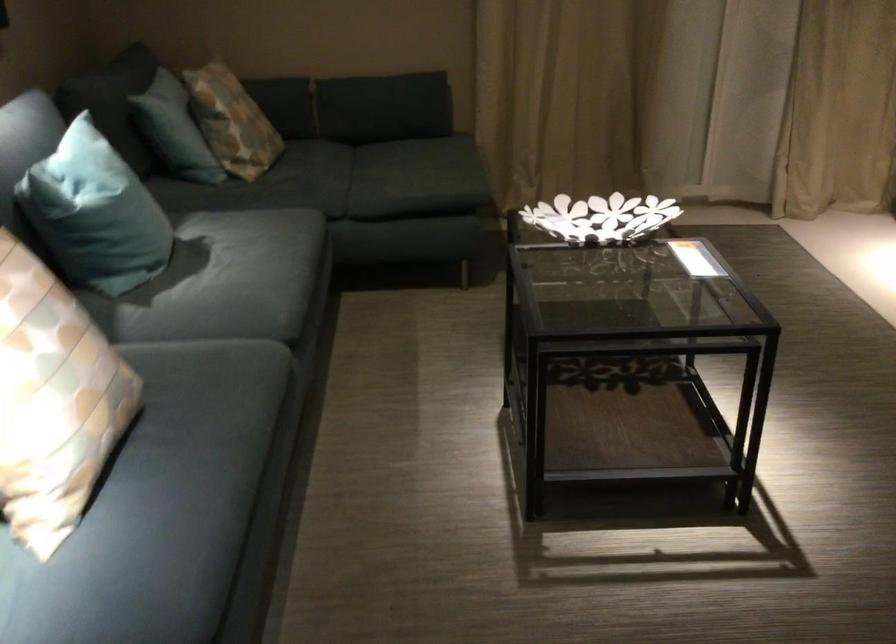
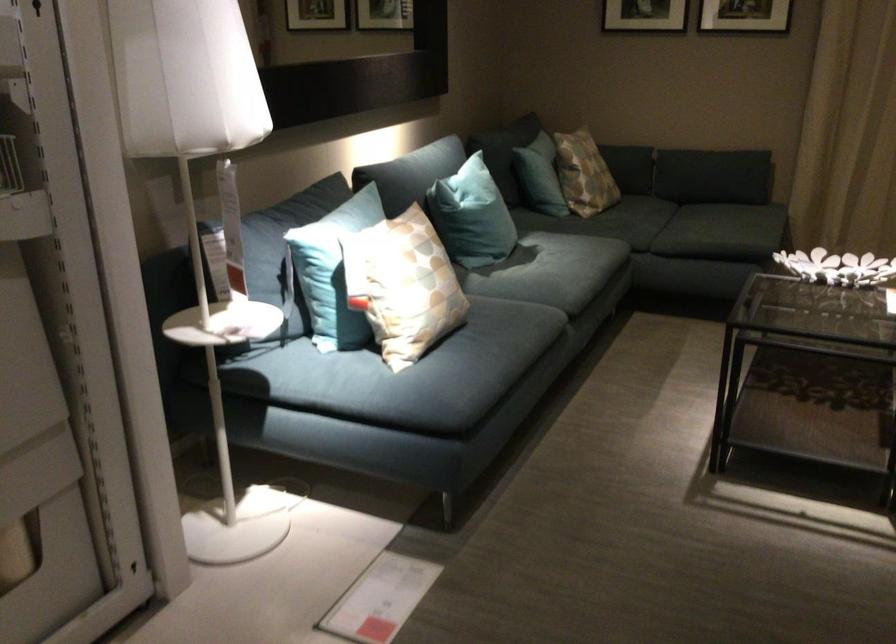
Locate, in the second image, the point that corresponds to [101,223] in the first image.

(471, 216)